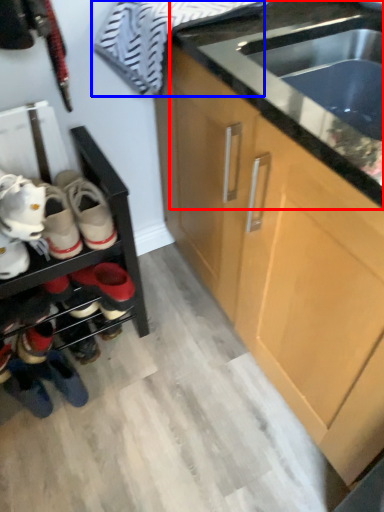
Question: Which object appears farthest to the camera in this image, countertop (highlighted by a red box) or laundry (highlighted by a blue box)?

Choices:
 (A) countertop
 (B) laundry

Answer: (B)